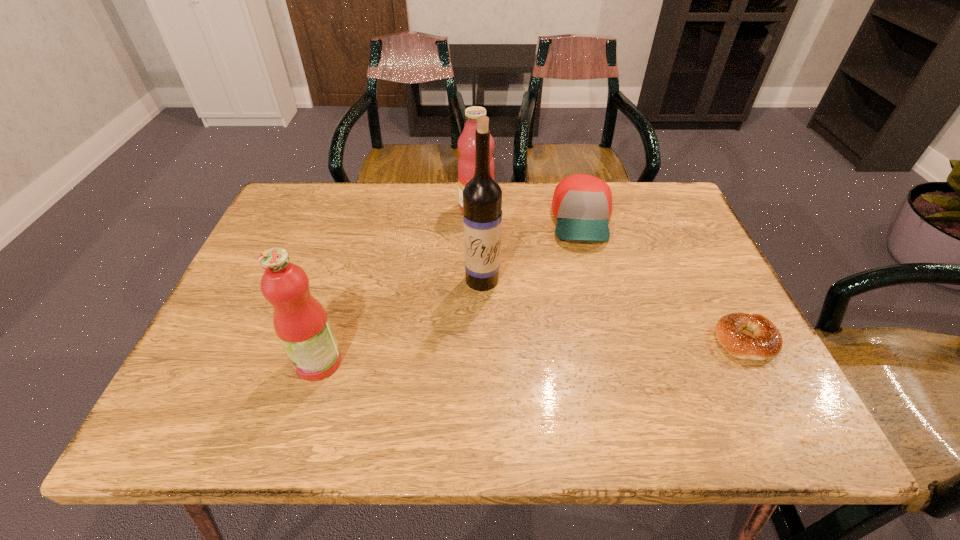
Identify the location of free space located 0.140m on the front label of the leftmost object. (228, 362).

Find the location of a particular element. Image resolution: width=960 pixels, height=540 pixels. blank space located on the front label of the leftmost object is located at coordinates (247, 362).

The height and width of the screenshot is (540, 960). Identify the location of vacant space situated on the left of the bagel. tap(659, 340).

Where is `blank space located 0.050m at the brim of the baseball cap`? This screenshot has width=960, height=540. blank space located 0.050m at the brim of the baseball cap is located at coordinates (588, 264).

This screenshot has width=960, height=540. What are the coordinates of `free location located at the brim of the baseball cap` in the screenshot? It's located at (596, 328).

This screenshot has height=540, width=960. I want to click on free space located 0.290m at the brim of the baseball cap, so click(597, 340).

This screenshot has height=540, width=960. Identify the location of free space located on the label of the right fruit juice. (486, 269).

Where is `free region located 0.050m on the label of the right fruit juice`? free region located 0.050m on the label of the right fruit juice is located at coordinates (480, 230).

You are a GUI agent. You are given a task and a screenshot of the screen. Output one action in this format:
    pyautogui.click(x=<x>, y=<y>)
    Task: Click on the vacant space located 0.300m on the label of the right fruit juice
    The image size is (960, 540).
    Given the screenshot: What is the action you would take?
    pyautogui.click(x=490, y=296)

Where is `free location located 0.160m on the label of the third nearest object`? free location located 0.160m on the label of the third nearest object is located at coordinates (479, 347).